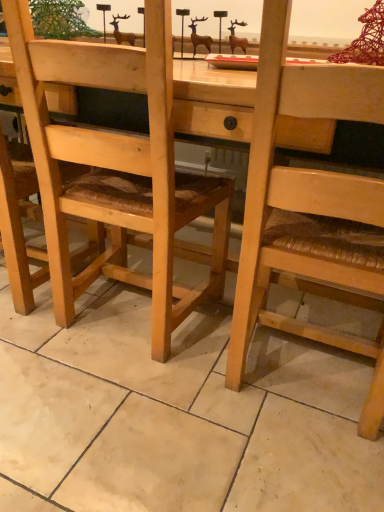
Question: Are wooden woven seat at center, placed as the second chair when sorted from right to left, and natural wood chair at center, which is the first chair in right-to-left order, located far from each other?

Choices:
 (A) yes
 (B) no

Answer: (B)

Question: Does wooden woven seat at center, placed as the second chair when sorted from right to left, have a greater width compared to natural wood chair at center, which is the second chair from left to right?

Choices:
 (A) yes
 (B) no

Answer: (B)

Question: Considering the relative sizes of wooden woven seat at center, which is the first chair from left to right, and natural wood chair at center, which is the second chair from left to right, in the image provided, is wooden woven seat at center, which is the first chair from left to right, smaller than natural wood chair at center, which is the second chair from left to right,?

Choices:
 (A) no
 (B) yes

Answer: (B)

Question: From the image's perspective, is wooden woven seat at center, which is the first chair from left to right, below natural wood chair at center, which is the first chair in right-to-left order?

Choices:
 (A) yes
 (B) no

Answer: (B)

Question: Is wooden woven seat at center, placed as the second chair when sorted from right to left, thinner than natural wood chair at center, which is the first chair in right-to-left order?

Choices:
 (A) no
 (B) yes

Answer: (B)

Question: Is wooden woven seat at center, placed as the second chair when sorted from right to left, aimed at natural wood chair at center, which is the first chair in right-to-left order?

Choices:
 (A) no
 (B) yes

Answer: (A)

Question: Considering the relative sizes of natural wood chair at center, which is the second chair from left to right, and wooden woven seat at center, which is the first chair from left to right, in the image provided, is natural wood chair at center, which is the second chair from left to right, thinner than wooden woven seat at center, which is the first chair from left to right,?

Choices:
 (A) no
 (B) yes

Answer: (A)

Question: From a real-world perspective, is natural wood chair at center, which is the first chair in right-to-left order, located higher than wooden woven seat at center, placed as the second chair when sorted from right to left?

Choices:
 (A) yes
 (B) no

Answer: (A)

Question: Can you confirm if natural wood chair at center, which is the second chair from left to right, is smaller than wooden woven seat at center, placed as the second chair when sorted from right to left?

Choices:
 (A) no
 (B) yes

Answer: (A)

Question: Does natural wood chair at center, which is the first chair in right-to-left order, have a larger size compared to wooden woven seat at center, placed as the second chair when sorted from right to left?

Choices:
 (A) yes
 (B) no

Answer: (A)

Question: Is natural wood chair at center, which is the second chair from left to right, not near wooden woven seat at center, which is the first chair from left to right?

Choices:
 (A) no
 (B) yes

Answer: (A)

Question: Does natural wood chair at center, which is the first chair in right-to-left order, come in front of wooden woven seat at center, which is the first chair from left to right?

Choices:
 (A) no
 (B) yes

Answer: (B)

Question: Considering the positions of natural wood chair at center, which is the first chair in right-to-left order, and wooden woven seat at center, placed as the second chair when sorted from right to left, in the image, is natural wood chair at center, which is the first chair in right-to-left order, wider or thinner than wooden woven seat at center, placed as the second chair when sorted from right to left,?

Choices:
 (A) thin
 (B) wide

Answer: (B)